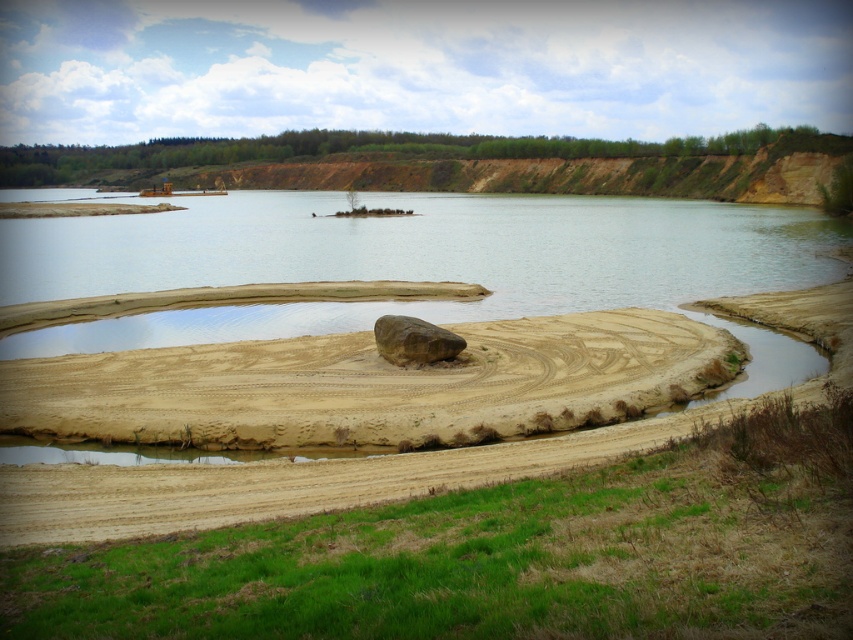
Consider the image. You are a hiker who wants to cross the clear water at center to reach the other side. The brown sandy dirt track at center is nearby. Which path would be higher in elevation?

The clear water at center has a greater height compared to the brown sandy dirt track at center, so the clear water at center is higher in elevation.

You are standing at the center of the image and see the point marked as point [759,355]. What is located at that point?

At point [759,355] lies a brown sandy puddle at lower right.

You are a hiker trying to reach the brown rough rock at center from the starting point near the brown sandy puddle at lower right. Which direction should you head to move towards the rock?

The brown sandy puddle at lower right is positioned on the right side of brown rough rock at center, so to reach the rock, you should head to the left from the puddle.